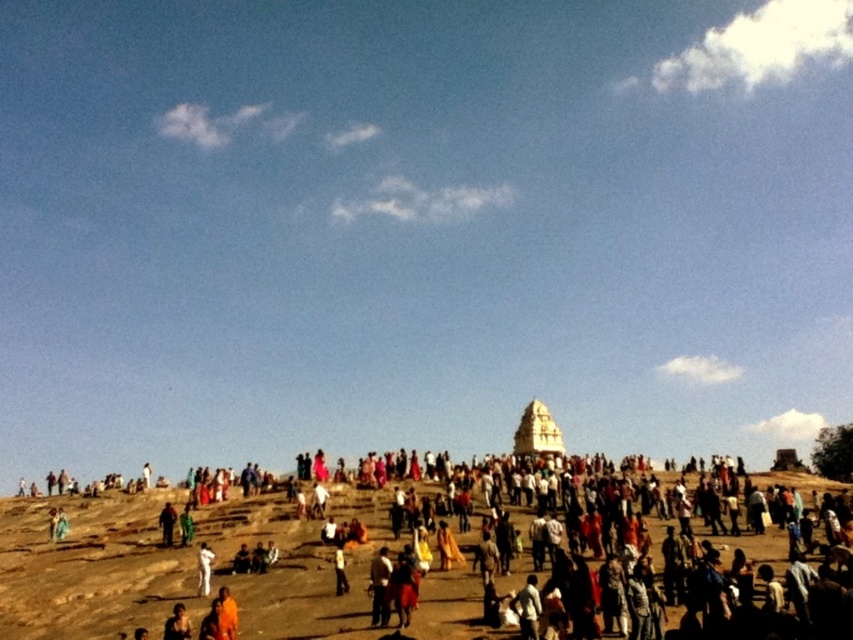
Who is more forward, [212,560] or [339,577]?

Point [339,577] is more forward.

Who is positioned more to the right, white fabric person at lower center or orange fabric person at center?

Positioned to the right is orange fabric person at center.

Find the location of `white fabric person at lower center`. white fabric person at lower center is located at coordinates (204, 568).

At what (x,y) coordinates should I click in order to perform the action: click on white fabric person at lower center. Please return your answer as a coordinate pair (x, y). The width and height of the screenshot is (853, 640). Looking at the image, I should click on (204, 568).

Is brown sandy ground at center smaller than orange fabric person at center?

No.

Who is shorter, brown sandy ground at center or orange fabric person at center?

orange fabric person at center

At what (x,y) coordinates should I click in order to perform the action: click on brown sandy ground at center. Please return your answer as a coordinate pair (x, y). The width and height of the screenshot is (853, 640). Looking at the image, I should click on (416, 566).

Which is more to the left, dark green fabric at lower left or orange fabric person at center?

From the viewer's perspective, dark green fabric at lower left appears more on the left side.

Does dark green fabric at lower left appear on the left side of orange fabric person at center?

Indeed, dark green fabric at lower left is positioned on the left side of orange fabric person at center.

This screenshot has width=853, height=640. What do you see at coordinates (167, 524) in the screenshot?
I see `dark green fabric at lower left` at bounding box center [167, 524].

You are a GUI agent. You are given a task and a screenshot of the screen. Output one action in this format:
    pyautogui.click(x=<x>, y=<y>)
    Task: Click on the dark green fabric at lower left
    The image size is (853, 640).
    Given the screenshot: What is the action you would take?
    pyautogui.click(x=167, y=524)